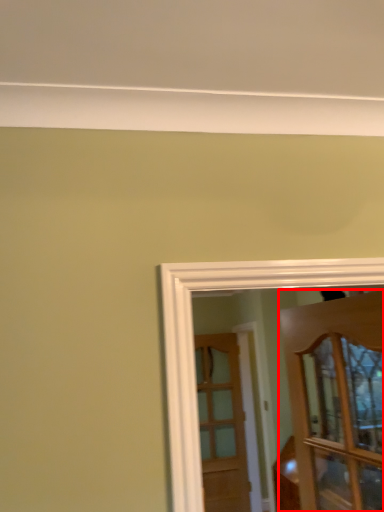
Question: From the image's perspective, where is door (annotated by the red box) located in relation to door in the image?

Choices:
 (A) below
 (B) above

Answer: (B)